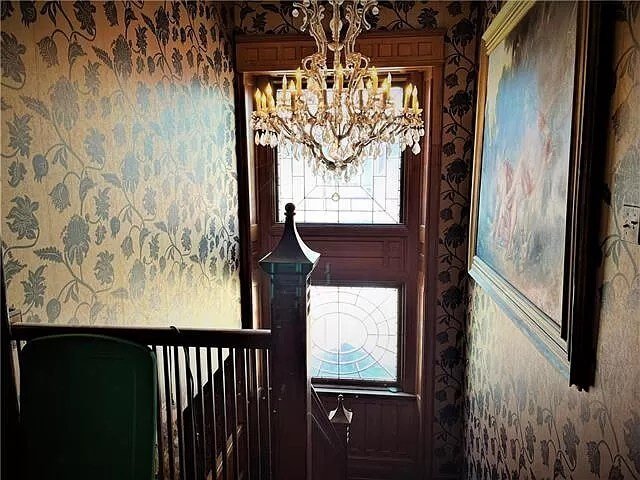
Locate an element on the screen. This screenshot has height=480, width=640. painting on right wall is located at coordinates (525, 214).